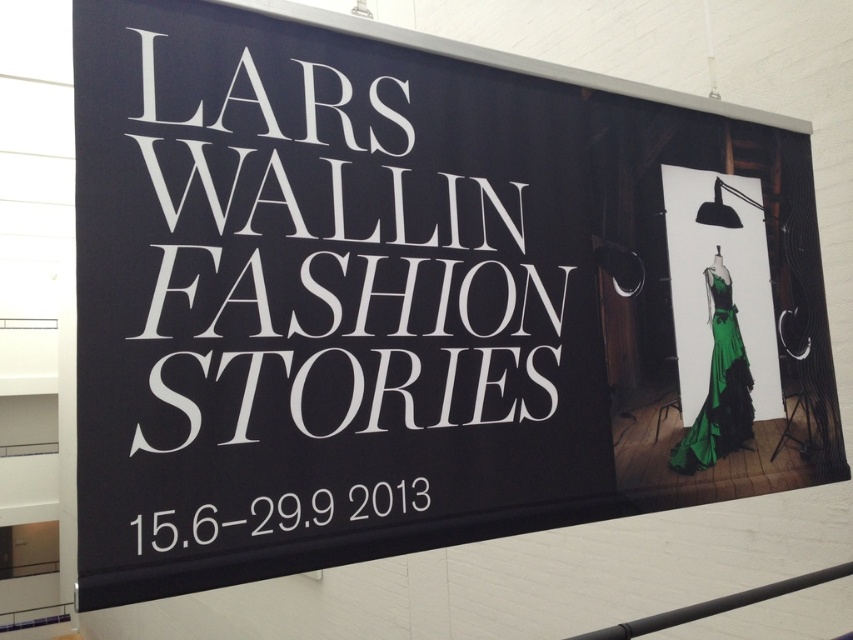
Between point (297, 525) and point (711, 275), which one is positioned in front?

Point (297, 525)

Between point (389, 483) and point (750, 435), which one is positioned behind?

The point (750, 435) is behind.

Find the location of a particular element. The image size is (853, 640). white text at center is located at coordinates (283, 515).